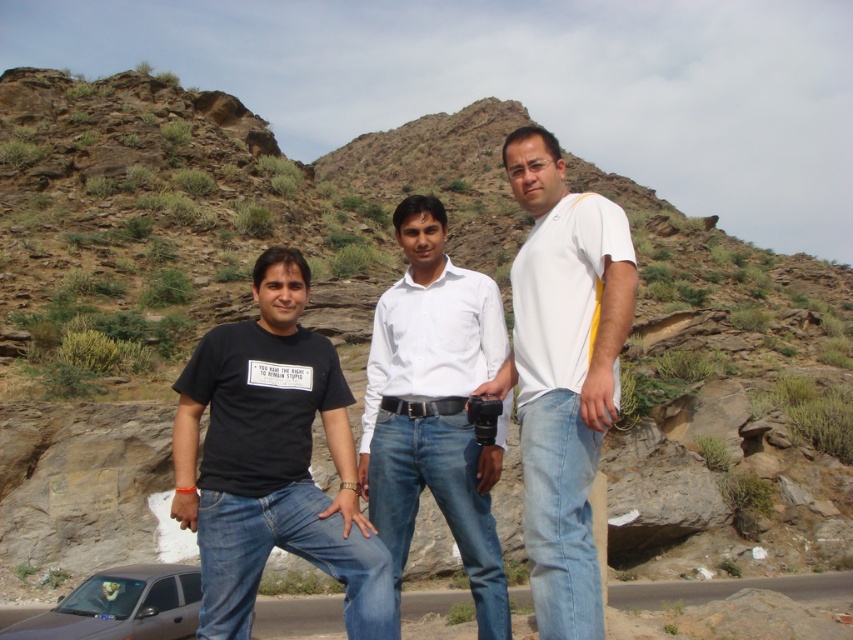
Question: Estimate the real-world distances between objects in this image. Which object is closer to the white smooth shirt at center?

Choices:
 (A) black matte t-shirt at left
 (B) black leather belt at center

Answer: (B)

Question: Can you confirm if white matte shirt at center is positioned to the right of brushed metal car at lower left?

Choices:
 (A) no
 (B) yes

Answer: (A)

Question: Estimate the real-world distances between objects in this image. Which object is closer to the black matte t-shirt at left?

Choices:
 (A) brushed metal car at lower left
 (B) white smooth shirt at center
 (C) metallic silver car at lower left

Answer: (B)

Question: Can you confirm if white smooth shirt at center is thinner than metallic silver car at lower left?

Choices:
 (A) no
 (B) yes

Answer: (B)

Question: Which object is positioned closest to the metallic silver car at lower left?

Choices:
 (A) black leather belt at center
 (B) black matte t-shirt at left
 (C) white matte shirt at center

Answer: (B)

Question: Does black matte t-shirt at left appear on the left side of white matte shirt at center?

Choices:
 (A) yes
 (B) no

Answer: (A)